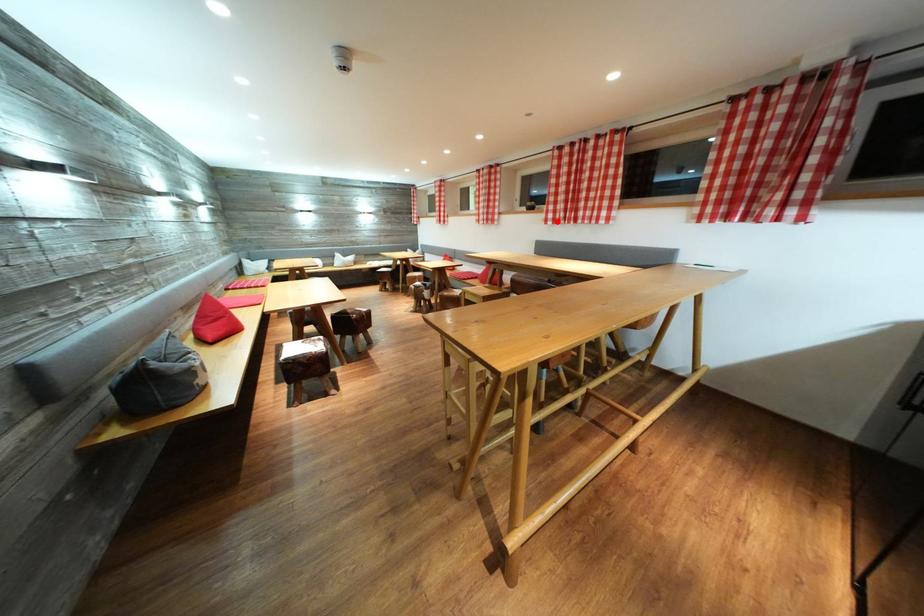
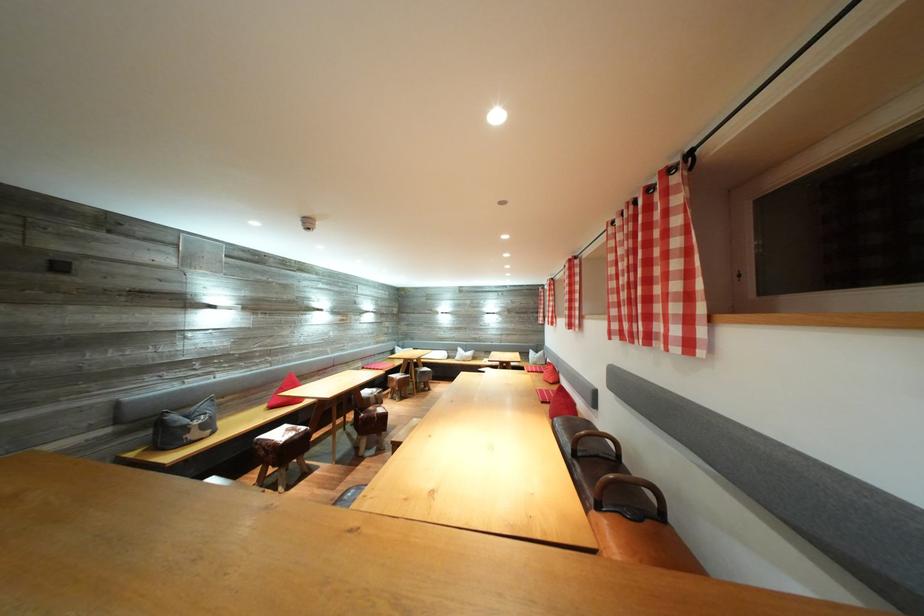
Question: I am providing you with two images of the same scene from different viewpoints. Image1 has a red point marked. In image2, the corresponding 3D location appears at what relative position? Reply with the corresponding letter.

Choices:
 (A) Closer
 (B) Farther

Answer: (B)